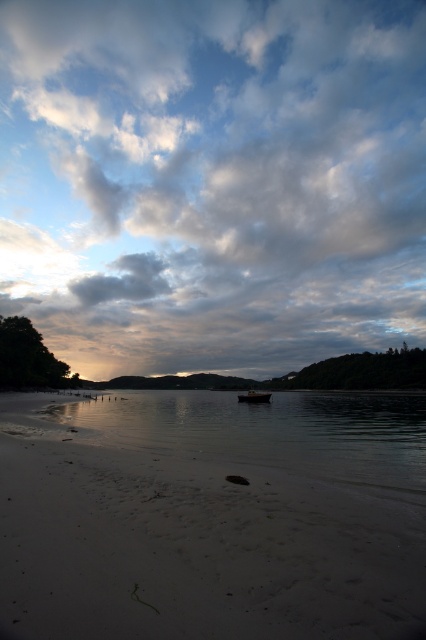
You are an artist planning to paint the coastal scene. You want to ensure the cloudy sky at upper center and wooden boat at center are proportionally accurate. Which object should you make larger in your painting?

The cloudy sky at upper center should be painted larger than the wooden boat at center because it is described as larger in size than the wooden boat at center.